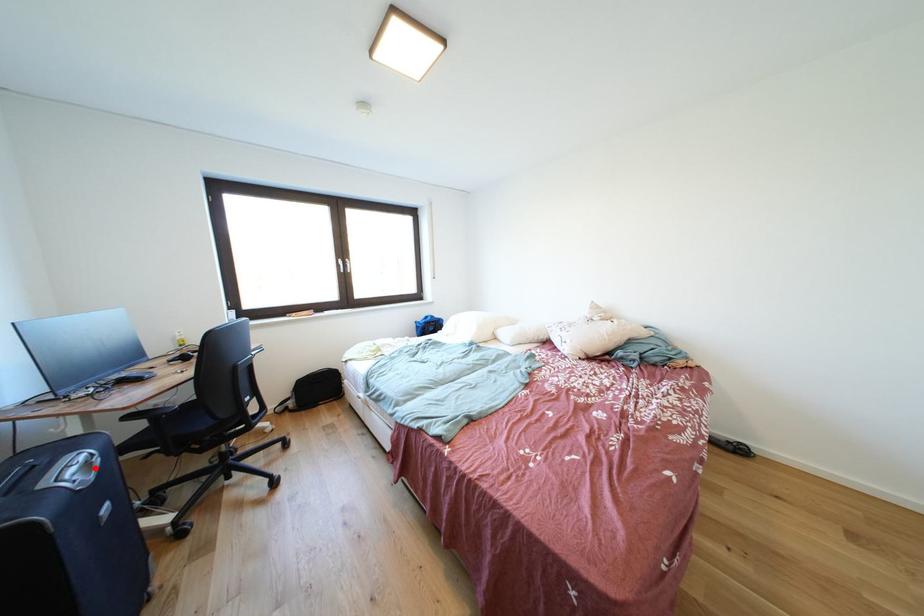
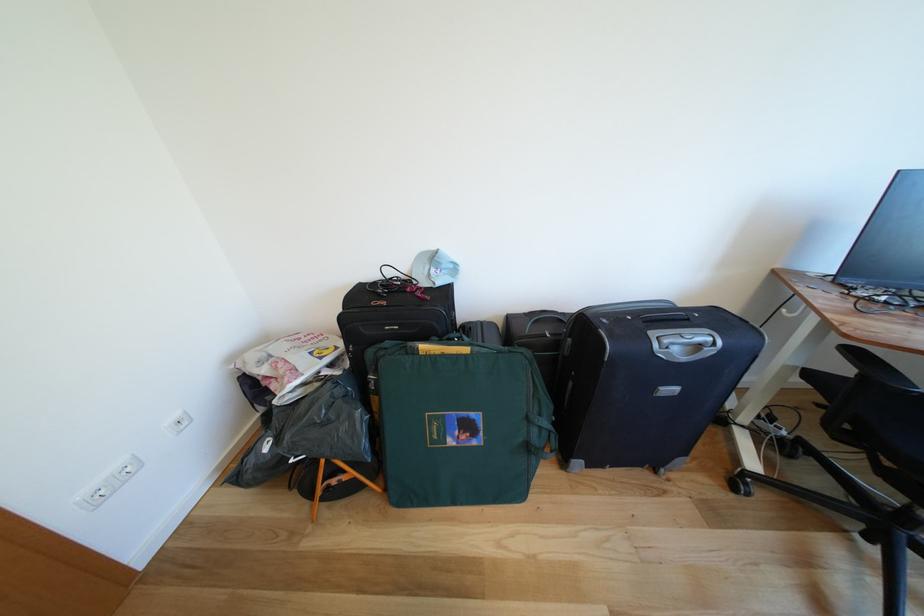
Find the pixel in the second image that matches the highlighted location in the first image.

(707, 351)